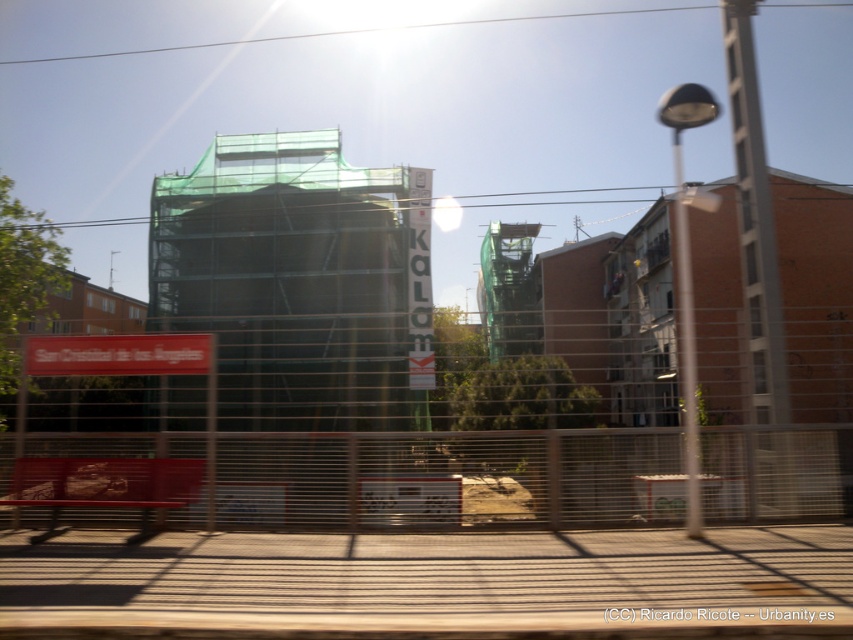
Does metallic wire mesh at center have a greater height compared to metallic wire mesh at lower center?

Correct, metallic wire mesh at center is much taller as metallic wire mesh at lower center.

Can you confirm if metallic wire mesh at center is shorter than metallic wire mesh at lower center?

In fact, metallic wire mesh at center may be taller than metallic wire mesh at lower center.

Measure the distance between metallic wire mesh at center and camera.

A distance of 8.04 meters exists between metallic wire mesh at center and camera.

Locate an element on the screen. metallic wire mesh at center is located at coordinates (339, 444).

Is point (184, 424) in front of point (198, 561)?

That is False.

Is point (189, 456) farther from viewer compared to point (689, 572)?

Yes, point (189, 456) is behind point (689, 572).

Image resolution: width=853 pixels, height=640 pixels. In order to click on metallic wire mesh at center in this screenshot , I will do `click(339, 444)`.

This screenshot has height=640, width=853. I want to click on brown wooden train track at lower center, so (x=431, y=584).

Is point (10, 568) less distant than point (24, 474)?

That is True.

Does point (741, 563) come closer to viewer compared to point (502, 467)?

That is True.

Identify the location of brown wooden train track at lower center. (431, 584).